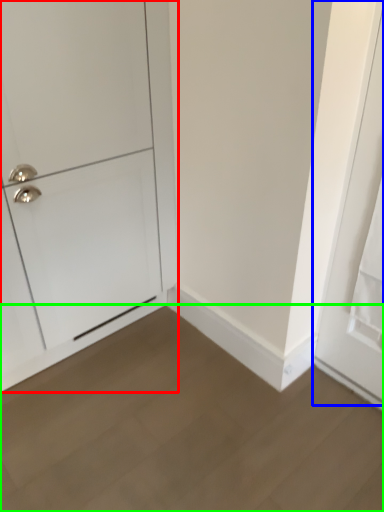
Question: Which object is the closest to the door (highlighted by a red box)? Choose among these: door (highlighted by a blue box) or plain (highlighted by a green box).

Choices:
 (A) door
 (B) plain

Answer: (B)